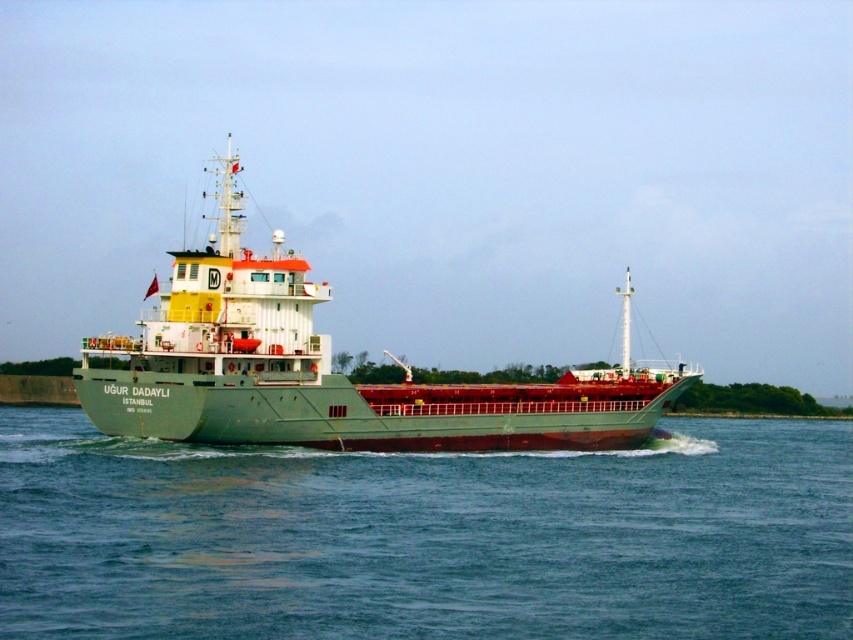
Question: Does green water at center appear over green matte ship at center?

Choices:
 (A) yes
 (B) no

Answer: (B)

Question: Does green water at center appear over green matte ship at center?

Choices:
 (A) yes
 (B) no

Answer: (B)

Question: Which point is farther from the camera taking this photo?

Choices:
 (A) (100, 481)
 (B) (680, 378)

Answer: (B)

Question: Can you confirm if green water at center is bigger than green matte ship at center?

Choices:
 (A) yes
 (B) no

Answer: (B)

Question: Which point appears closest to the camera in this image?

Choices:
 (A) (196, 273)
 (B) (90, 545)

Answer: (B)